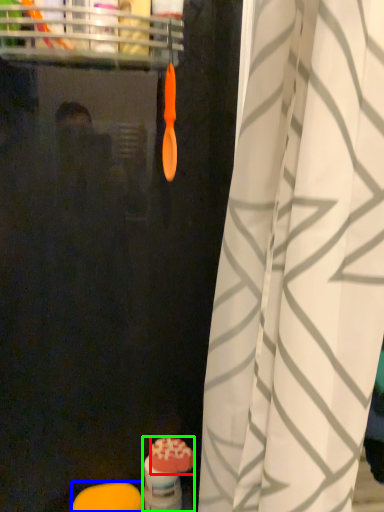
Question: Based on their relative distances, which object is nearer to soap (highlighted by a red box)? Choose from soap (highlighted by a blue box) and toiletry (highlighted by a green box).

Choices:
 (A) soap
 (B) toiletry

Answer: (B)